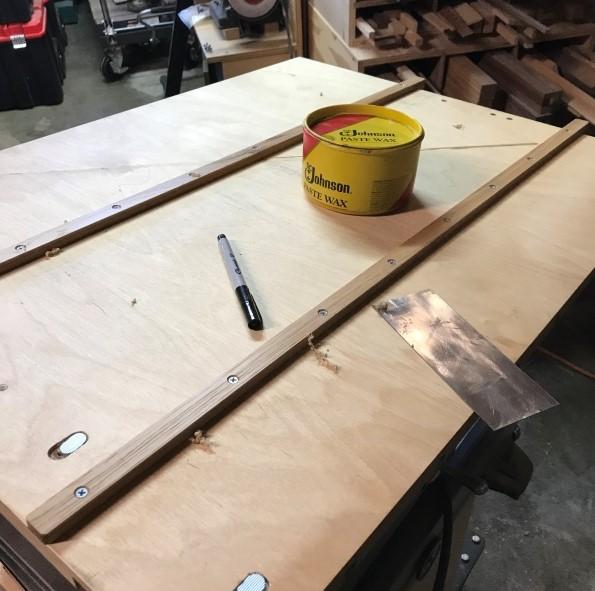
The image size is (595, 591). I want to click on lid on the box, so (x=37, y=15).